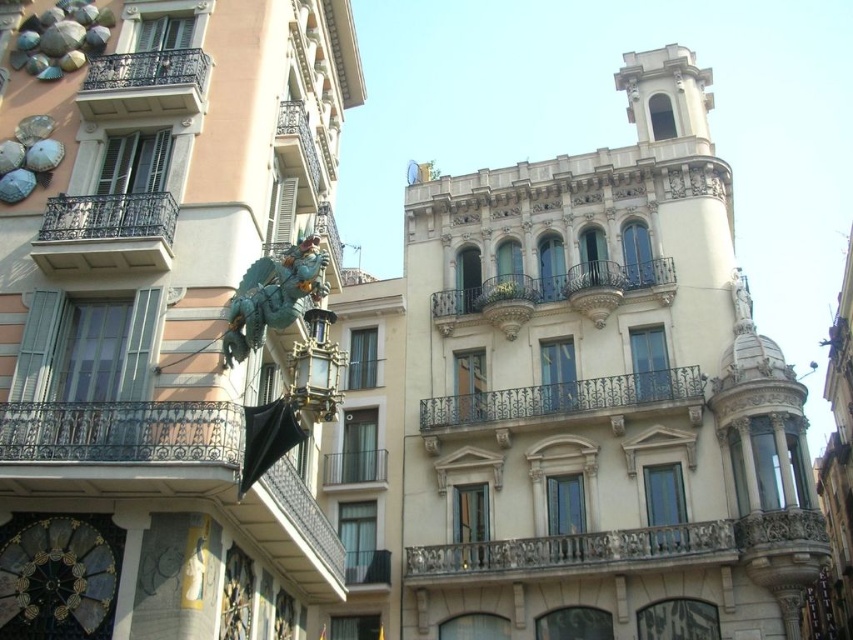
At what (x,y) coordinates should I click in order to perform the action: click on carved stone balcony at center. Please return your answer as a coordinate pair (x, y). Looking at the image, I should click on (569, 554).

Can you confirm if carved stone balcony at center is positioned above metallic silver balcony at center?

Actually, carved stone balcony at center is below metallic silver balcony at center.

The width and height of the screenshot is (853, 640). In order to click on carved stone balcony at center in this screenshot , I will do `click(569, 554)`.

Find the location of a particular element. This screenshot has width=853, height=640. carved stone balcony at center is located at coordinates (569, 554).

Which is above, rustic wrought iron balcony at lower left or dark brown wrought iron balcony at left?

dark brown wrought iron balcony at left is higher up.

Between rustic wrought iron balcony at lower left and dark brown wrought iron balcony at left, which one appears on the left side from the viewer's perspective?

Positioned to the left is dark brown wrought iron balcony at left.

Which is behind, point (192, 481) or point (117, 264)?

Point (117, 264)

I want to click on rustic wrought iron balcony at lower left, so (170, 472).

Who is positioned more to the right, carved stone balcony at center or dark brown wrought iron balcony at left?

From the viewer's perspective, carved stone balcony at center appears more on the right side.

Is carved stone balcony at center to the right of dark brown wrought iron balcony at left from the viewer's perspective?

Yes, carved stone balcony at center is to the right of dark brown wrought iron balcony at left.

Locate an element on the screen. The height and width of the screenshot is (640, 853). carved stone balcony at center is located at coordinates (569, 554).

This screenshot has width=853, height=640. What are the coordinates of `carved stone balcony at center` in the screenshot? It's located at (569, 554).